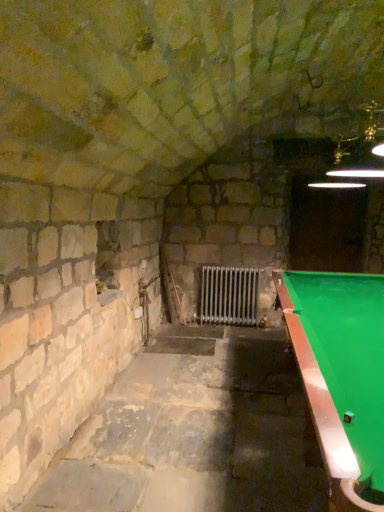
Question: Is green felt pool table at right outside of metallic silver radiator at center?

Choices:
 (A) yes
 (B) no

Answer: (A)

Question: Does green felt pool table at right have a lesser height compared to metallic silver radiator at center?

Choices:
 (A) no
 (B) yes

Answer: (A)

Question: Is green felt pool table at right at the left side of metallic silver radiator at center?

Choices:
 (A) no
 (B) yes

Answer: (A)

Question: Considering the relative positions of green felt pool table at right and metallic silver radiator at center in the image provided, is green felt pool table at right in front of metallic silver radiator at center?

Choices:
 (A) no
 (B) yes

Answer: (B)

Question: Is green felt pool table at right turned away from metallic silver radiator at center?

Choices:
 (A) no
 (B) yes

Answer: (A)

Question: Can you confirm if green felt pool table at right is positioned to the right of metallic silver radiator at center?

Choices:
 (A) no
 (B) yes

Answer: (B)

Question: Considering the relative positions of metallic silver radiator at center and green felt pool table at right in the image provided, is metallic silver radiator at center to the left of green felt pool table at right from the viewer's perspective?

Choices:
 (A) yes
 (B) no

Answer: (A)

Question: From the image's perspective, is metallic silver radiator at center on green felt pool table at right?

Choices:
 (A) no
 (B) yes

Answer: (B)

Question: Is metallic silver radiator at center behind green felt pool table at right?

Choices:
 (A) yes
 (B) no

Answer: (A)

Question: From a real-world perspective, is metallic silver radiator at center on green felt pool table at right?

Choices:
 (A) no
 (B) yes

Answer: (A)

Question: Is metallic silver radiator at center positioned with its back to green felt pool table at right?

Choices:
 (A) yes
 (B) no

Answer: (B)

Question: Can you confirm if metallic silver radiator at center is taller than green felt pool table at right?

Choices:
 (A) yes
 (B) no

Answer: (B)

Question: Considering their positions, is green felt pool table at right located in front of or behind metallic silver radiator at center?

Choices:
 (A) behind
 (B) front

Answer: (B)